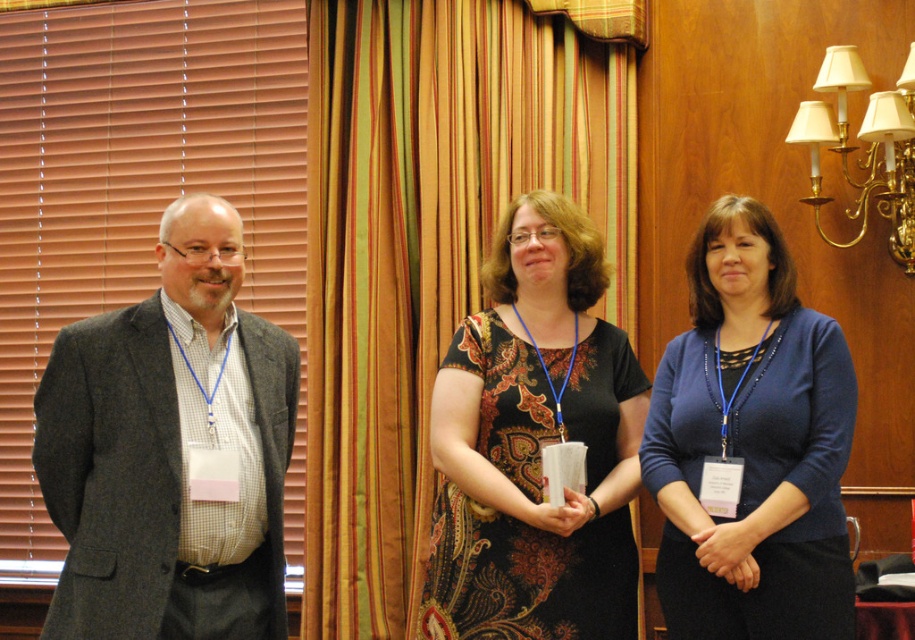
Does point (267, 618) come behind point (584, 221)?

No, it is in front of (584, 221).

Which is in front, point (128, 568) or point (440, 540)?

Point (128, 568) is more forward.

Where is `gray wool suit at left`? gray wool suit at left is located at coordinates (170, 449).

Between gray wool suit at left and blue fabric sweater at center, which one appears on the left side from the viewer's perspective?

gray wool suit at left

Looking at this image, does gray wool suit at left come behind blue fabric sweater at center?

No.

Between point (78, 435) and point (776, 356), which one is positioned in front?

Point (78, 435) is in front.

Find the location of a particular element. gray wool suit at left is located at coordinates (170, 449).

Who is positioned more to the right, striped fabric curtain at center or paisley-patterned dress at center?

paisley-patterned dress at center

Can you confirm if striped fabric curtain at center is taller than paisley-patterned dress at center?

Yes, striped fabric curtain at center is taller than paisley-patterned dress at center.

Which is in front, point (632, 106) or point (494, 346)?

Point (494, 346) is in front.

Find the location of a particular element. The height and width of the screenshot is (640, 915). striped fabric curtain at center is located at coordinates (428, 250).